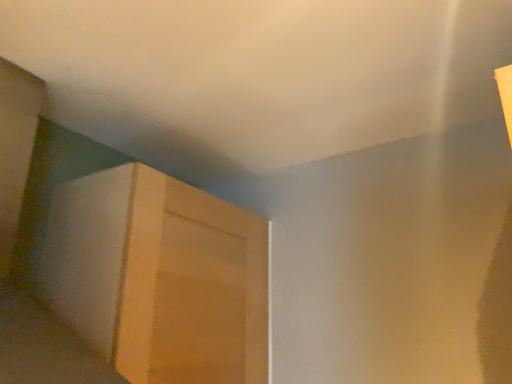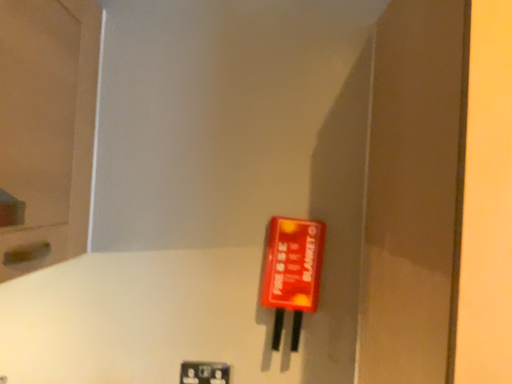
Question: Which way did the camera rotate in the video?

Choices:
 (A) rotated downward
 (B) rotated upward

Answer: (A)